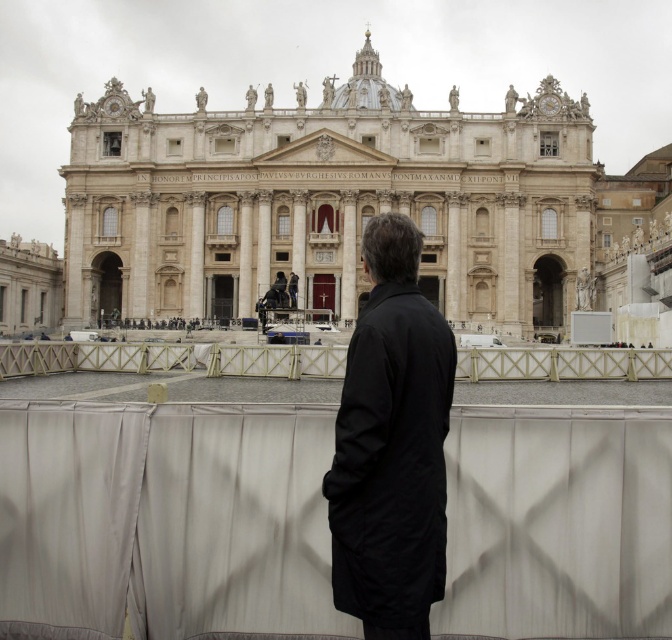
Question: Does black matte coat at center appear on the left side of white wooden rail at center?

Choices:
 (A) no
 (B) yes

Answer: (A)

Question: Which point is closer to the camera?

Choices:
 (A) beige stone palace at center
 (B) white wooden rail at center

Answer: (B)

Question: Is beige stone palace at center to the right of black matte coat at center from the viewer's perspective?

Choices:
 (A) no
 (B) yes

Answer: (A)

Question: Which of these objects is positioned farthest from the beige stone palace at center?

Choices:
 (A) white wooden rail at center
 (B) black matte coat at center

Answer: (B)

Question: Is beige stone palace at center behind black matte coat at center?

Choices:
 (A) yes
 (B) no

Answer: (A)

Question: Considering the real-world distances, which object is farthest from the beige stone palace at center?

Choices:
 (A) black matte coat at center
 (B) white wooden rail at center

Answer: (A)